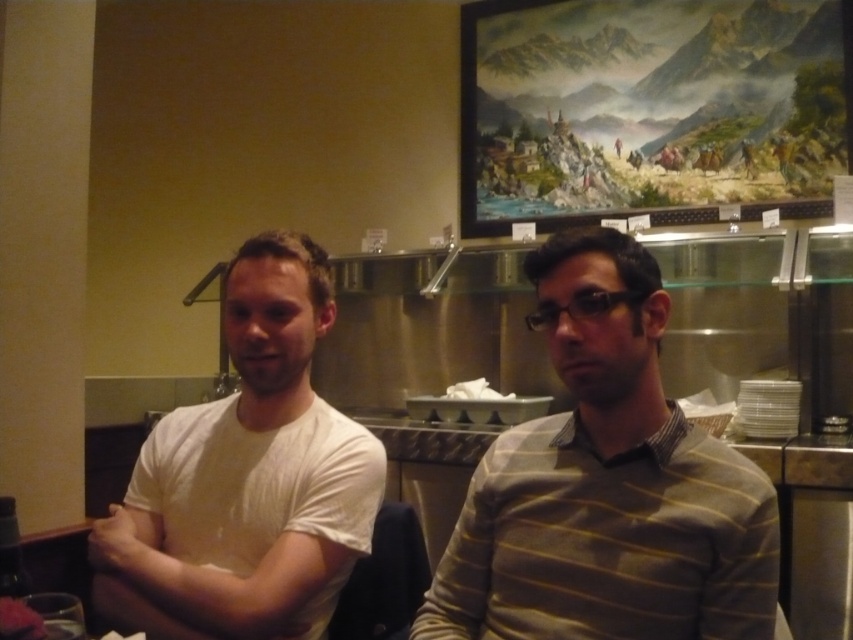
Between striped sweater at center and white cotton t-shirt at left, which one has more height?

With more height is white cotton t-shirt at left.

Is striped sweater at center shorter than white cotton t-shirt at left?

Indeed, striped sweater at center has a lesser height compared to white cotton t-shirt at left.

Is point (613, 470) behind point (120, 609)?

No, it is in front of (120, 609).

Where is `striped sweater at center`? striped sweater at center is located at coordinates (606, 484).